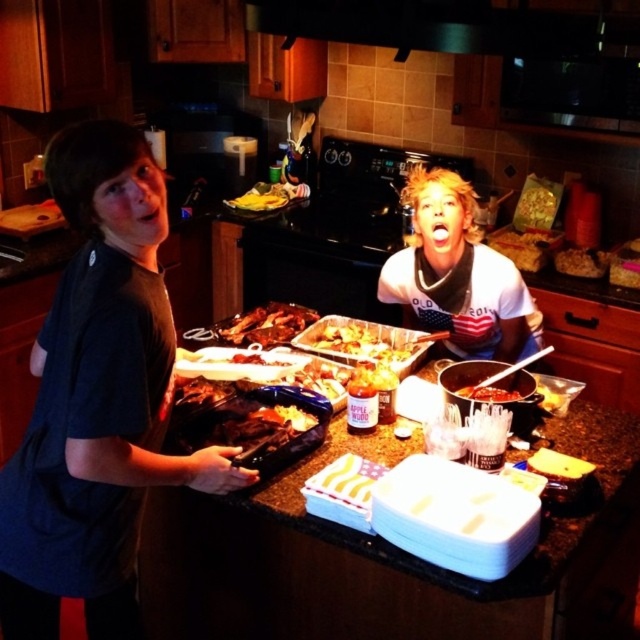
Is point (321, 29) closer to camera compared to point (570, 260)?

Yes, it is.

Which is in front, point (496, 16) or point (566, 268)?

Positioned in front is point (496, 16).

Locate an element on the screen. black matte exhaust hood at upper center is located at coordinates (451, 26).

Can you confirm if dark blue shirt at left is smaller than yellow banana at upper center?

No.

Can you confirm if dark blue shirt at left is wider than yellow banana at upper center?

Yes.

Is point (65, 307) farther from camera compared to point (256, 211)?

No, it is not.

Locate an element on the screen. Image resolution: width=640 pixels, height=640 pixels. dark blue shirt at left is located at coordinates (97, 403).

Is black matte exhaust hood at upper center below golden crispy chicken at center?

Incorrect, black matte exhaust hood at upper center is not positioned below golden crispy chicken at center.

Locate an element on the screen. black matte exhaust hood at upper center is located at coordinates (451, 26).